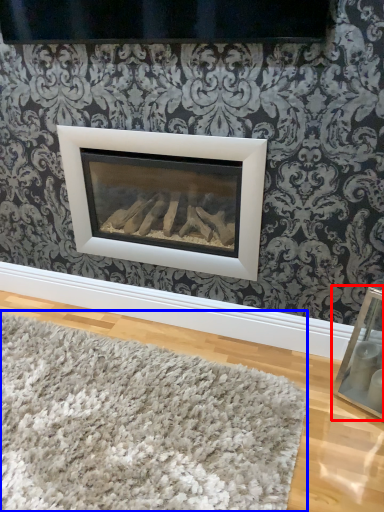
Question: Which object appears farthest to the camera in this image, picture frame (highlighted by a red box) or mat (highlighted by a blue box)?

Choices:
 (A) picture frame
 (B) mat

Answer: (A)